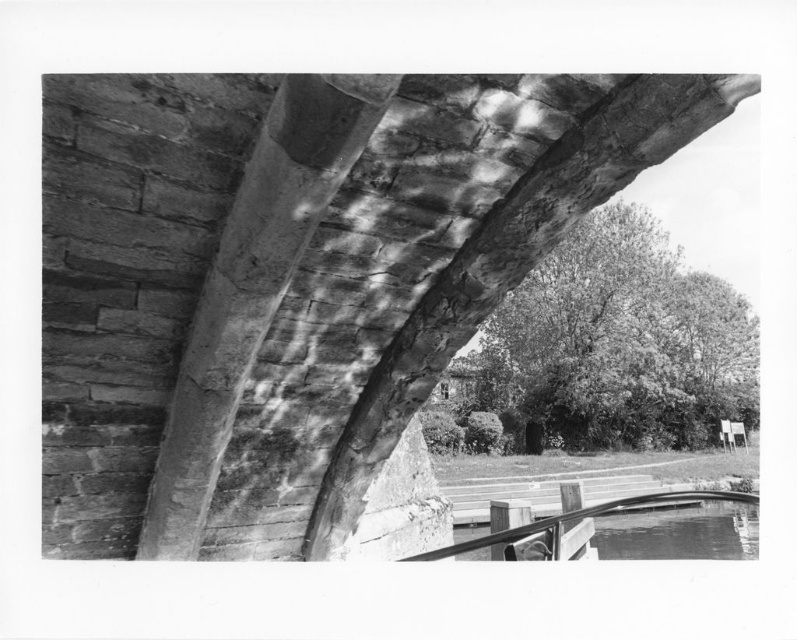
You are an architect analyzing the structural integrity of the stone bridge. Given that the stone textured bridge at upper center is wider than the rough stone beam at center, which object would you prioritize inspecting for potential weaknesses?

The rough stone beam at center would need closer inspection since it is narrower and might be more susceptible to stress compared to the wider stone textured bridge at upper center.

You are an architect examining the stone bridge structure. Based on the image, where is the stone textured bridge at upper center located in relation to the rough stone beam at center?

The stone textured bridge at upper center is located below the rough stone beam at center.

You are an architect examining the stone bridge structure. You notice the stone textured bridge at upper center and the rough stone beam at center. Which object is positioned further away from your viewpoint?

The rough stone beam at center is behind the stone textured bridge at upper center, so it is positioned further away from your viewpoint.